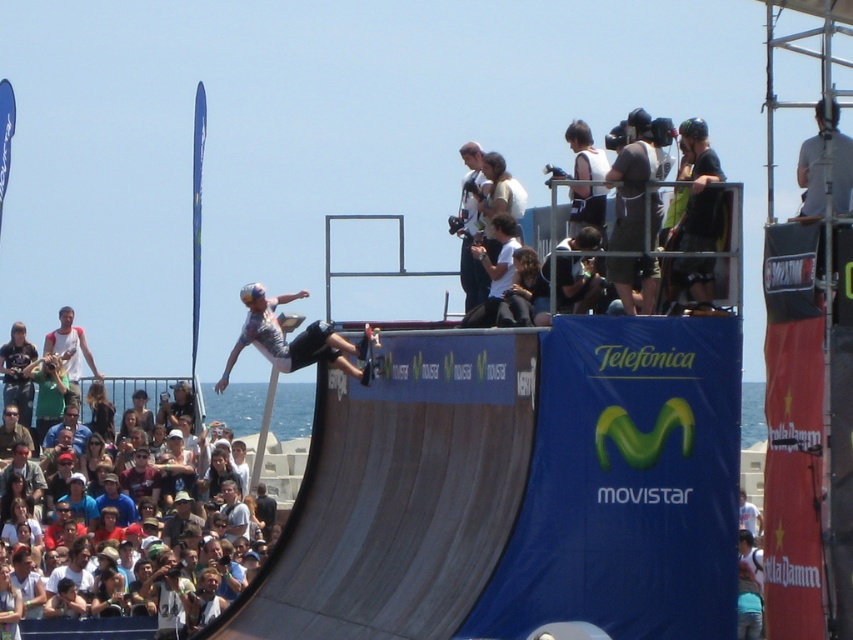
Can you confirm if matte gray helmet at center is positioned above white cotton t-shirt at lower left?

Correct, matte gray helmet at center is located above white cotton t-shirt at lower left.

Is point (367, 374) closer to camera compared to point (141, 528)?

Yes, point (367, 374) is in front of point (141, 528).

This screenshot has height=640, width=853. What do you see at coordinates (294, 339) in the screenshot?
I see `matte gray helmet at center` at bounding box center [294, 339].

At what (x,y) coordinates should I click in order to perform the action: click on matte gray helmet at center. Please return your answer as a coordinate pair (x, y). The image size is (853, 640). Looking at the image, I should click on (294, 339).

Is matte gray helmet at center below black matte skateboard at center?

Actually, matte gray helmet at center is above black matte skateboard at center.

The image size is (853, 640). Describe the element at coordinates (294, 339) in the screenshot. I see `matte gray helmet at center` at that location.

I want to click on matte gray helmet at center, so click(294, 339).

Is point (265, 531) less distant than point (376, 342)?

No, it is not.

Measure the distance from white cotton t-shirt at lower left to black matte skateboard at center.

white cotton t-shirt at lower left is 14.68 meters away from black matte skateboard at center.

Describe the element at coordinates (90, 628) in the screenshot. I see `white cotton t-shirt at lower left` at that location.

Locate an element on the screen. Image resolution: width=853 pixels, height=640 pixels. white cotton t-shirt at lower left is located at coordinates (90, 628).